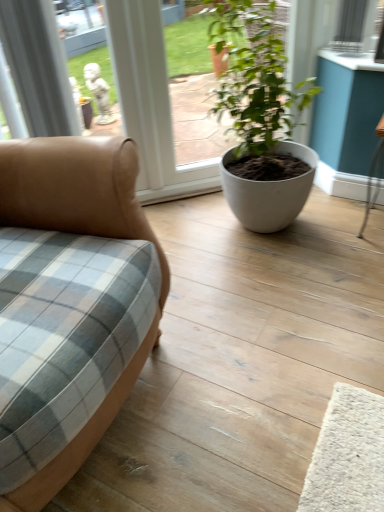
Question: Is white matte pot at center oriented away from tan leather couch at left?

Choices:
 (A) yes
 (B) no

Answer: (B)

Question: Is white matte pot at center bigger than tan leather couch at left?

Choices:
 (A) no
 (B) yes

Answer: (A)

Question: Is white matte pot at center not inside tan leather couch at left?

Choices:
 (A) no
 (B) yes

Answer: (B)

Question: Is the depth of white matte pot at center greater than that of tan leather couch at left?

Choices:
 (A) no
 (B) yes

Answer: (B)

Question: Can you confirm if white matte pot at center is wider than tan leather couch at left?

Choices:
 (A) yes
 (B) no

Answer: (B)

Question: Is white matte pot at center smaller than tan leather couch at left?

Choices:
 (A) yes
 (B) no

Answer: (A)

Question: Could white matte pot at center be considered to be inside tan leather couch at left?

Choices:
 (A) no
 (B) yes

Answer: (A)

Question: Is tan leather couch at left facing away from white matte pot at center?

Choices:
 (A) no
 (B) yes

Answer: (A)

Question: Is tan leather couch at left far away from white matte pot at center?

Choices:
 (A) yes
 (B) no

Answer: (B)

Question: Considering the relative sizes of tan leather couch at left and white matte pot at center in the image provided, is tan leather couch at left thinner than white matte pot at center?

Choices:
 (A) no
 (B) yes

Answer: (A)

Question: From the image's perspective, is tan leather couch at left beneath white matte pot at center?

Choices:
 (A) no
 (B) yes

Answer: (B)

Question: Is tan leather couch at left at the right side of white matte pot at center?

Choices:
 (A) no
 (B) yes

Answer: (A)

Question: In terms of width, does tan leather couch at left look wider or thinner when compared to white matte pot at center?

Choices:
 (A) thin
 (B) wide

Answer: (B)